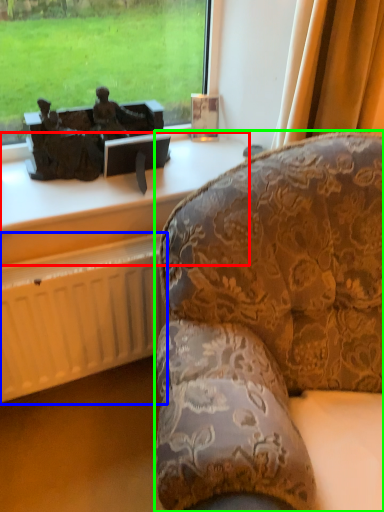
Question: Which object is the farthest from furniture (highlighted by a red box)? Choose among these: radiator (highlighted by a blue box) or studio couch (highlighted by a green box).

Choices:
 (A) radiator
 (B) studio couch

Answer: (B)